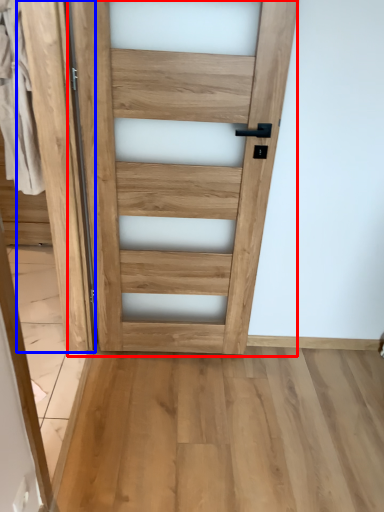
Question: Among these objects, which one is farthest to the camera, door (highlighted by a red box) or barn door (highlighted by a blue box)?

Choices:
 (A) door
 (B) barn door

Answer: (A)